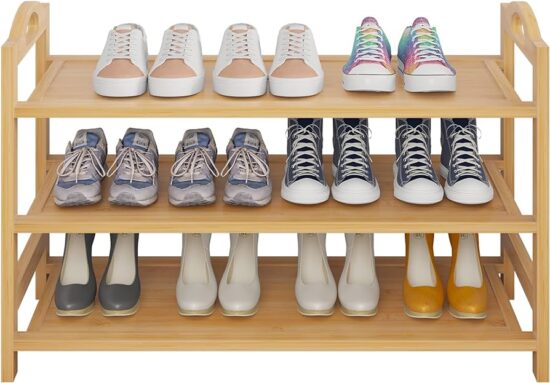
Locate an element on the screen. The height and width of the screenshot is (383, 550). shoes on the middle shelf is located at coordinates (92, 168), (131, 171), (188, 170), (232, 169), (302, 166), (353, 166), (421, 173), (469, 173).